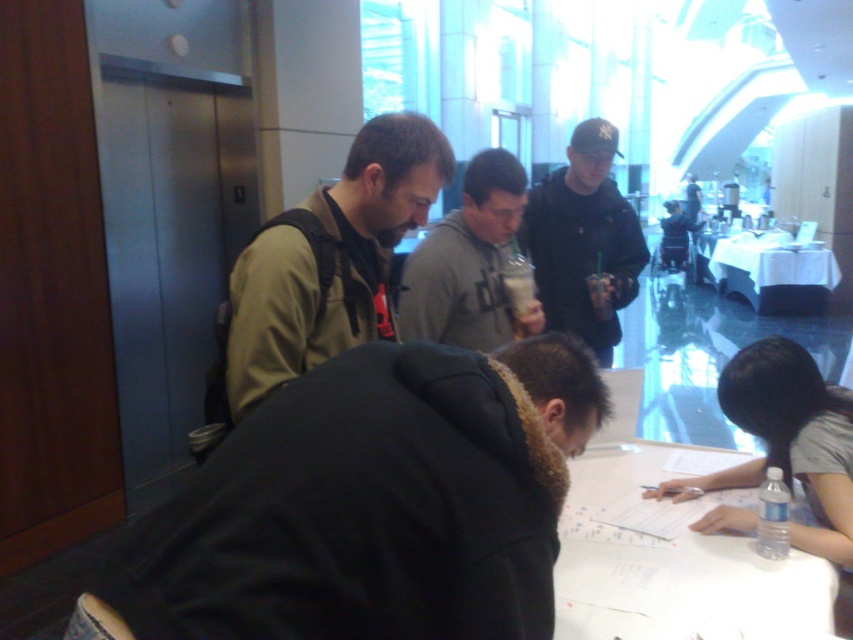
Who is more forward, (619, 472) or (434, 291)?

Point (619, 472) is in front.

This screenshot has width=853, height=640. Describe the element at coordinates (671, 566) in the screenshot. I see `white paper at lower right` at that location.

What do you see at coordinates (671, 566) in the screenshot?
I see `white paper at lower right` at bounding box center [671, 566].

Find the location of `white paper at lower right`. white paper at lower right is located at coordinates (671, 566).

Can you confirm if black matte jacket at upper center is wider than gray matte hoodie at center?

Yes, black matte jacket at upper center is wider than gray matte hoodie at center.

Describe the element at coordinates (584, 241) in the screenshot. Image resolution: width=853 pixels, height=640 pixels. I see `black matte jacket at upper center` at that location.

Which is in front, point (570, 323) or point (508, 188)?

Point (508, 188) is in front.

I want to click on black matte jacket at upper center, so click(x=584, y=241).

Does white paper at lower right lie in front of white cloth table at center?

Yes.

Is white paper at lower right further to camera compared to white cloth table at center?

That is False.

Who is more forward, [698,609] or [776,260]?

Point [698,609]

At what (x,y) coordinates should I click in order to perform the action: click on white paper at lower right. Please return your answer as a coordinate pair (x, y). The width and height of the screenshot is (853, 640). Looking at the image, I should click on (671, 566).